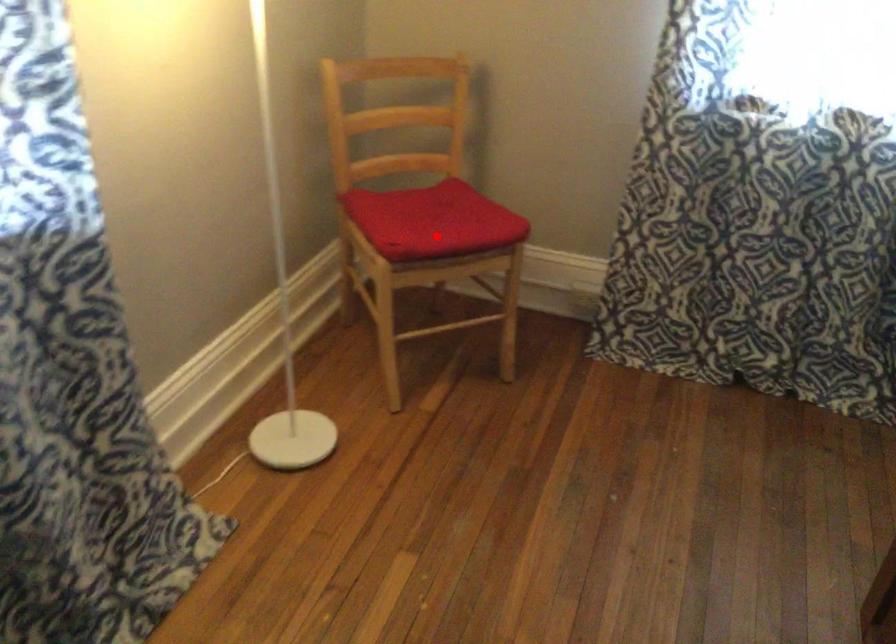
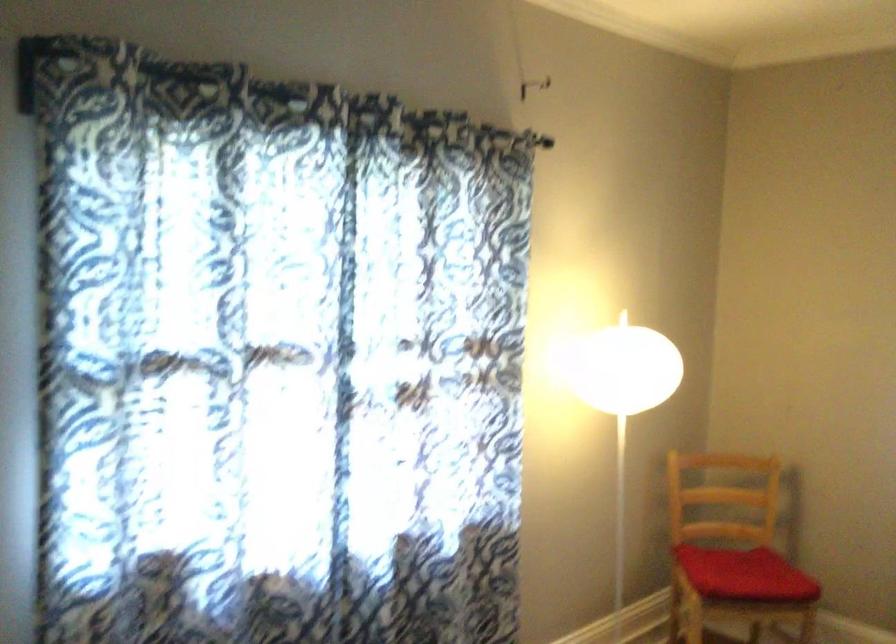
The point at the highlighted location is marked in the first image. Where is the corresponding point in the second image?

(745, 574)